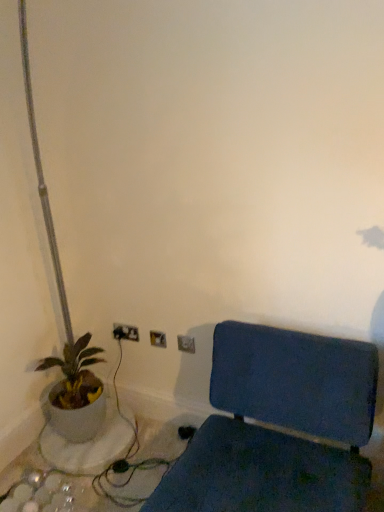
Question: In which direction should I rotate to look at metallic silver electric outlet at upper center, arranged as the first electric outlet when viewed from the right?

Choices:
 (A) left
 (B) right

Answer: (A)

Question: Does metallic silver electric outlet at center, the second electric outlet positioned from the back, have a smaller size compared to metallic silver electric outlet at upper center, acting as the 1th electric outlet starting from the front?

Choices:
 (A) no
 (B) yes

Answer: (B)

Question: Can you confirm if metallic silver electric outlet at center, which is the second electric outlet in front-to-back order, is shorter than metallic silver electric outlet at upper center, arranged as the first electric outlet when viewed from the right?

Choices:
 (A) yes
 (B) no

Answer: (A)

Question: Is metallic silver electric outlet at center, placed as the 2th electric outlet when sorted from left to right, to the right of metallic silver electric outlet at upper center, arranged as the first electric outlet when viewed from the right, from the viewer's perspective?

Choices:
 (A) yes
 (B) no

Answer: (B)

Question: Would you say metallic silver electric outlet at center, acting as the second electric outlet starting from the right, is a long distance from metallic silver electric outlet at upper center, arranged as the first electric outlet when viewed from the right?

Choices:
 (A) no
 (B) yes

Answer: (A)

Question: Could you tell me if metallic silver electric outlet at center, placed as the 2th electric outlet when sorted from left to right, is facing metallic silver electric outlet at upper center, which is the 3th electric outlet in left-to-right order?

Choices:
 (A) no
 (B) yes

Answer: (A)

Question: Is metallic silver electric outlet at center, acting as the second electric outlet starting from the right, completely or partially outside of metallic silver electric outlet at upper center, arranged as the first electric outlet when viewed from the right?

Choices:
 (A) yes
 (B) no

Answer: (A)

Question: Does metallic silver electric outlet at upper center, acting as the 1th electric outlet starting from the front, have a greater width compared to matte white pot at left?

Choices:
 (A) no
 (B) yes

Answer: (A)

Question: Could you tell me if metallic silver electric outlet at upper center, which is the 3th electric outlet in left-to-right order, is turned towards matte white pot at left?

Choices:
 (A) no
 (B) yes

Answer: (A)

Question: From the image's perspective, is metallic silver electric outlet at upper center, arranged as the first electric outlet when viewed from the right, on matte white pot at left?

Choices:
 (A) yes
 (B) no

Answer: (A)

Question: Is metallic silver electric outlet at upper center, the third electric outlet when ordered from back to front, oriented away from matte white pot at left?

Choices:
 (A) no
 (B) yes

Answer: (A)

Question: From a real-world perspective, is metallic silver electric outlet at upper center, acting as the 1th electric outlet starting from the front, physically below matte white pot at left?

Choices:
 (A) yes
 (B) no

Answer: (B)

Question: Can you confirm if metallic silver electric outlet at upper center, the third electric outlet when ordered from back to front, is positioned to the right of matte white pot at left?

Choices:
 (A) yes
 (B) no

Answer: (A)

Question: Can you confirm if metallic silver electric outlet at upper center, the third electric outlet when ordered from back to front, is shorter than metallic silver electric outlet at lower center, placed as the 1th electric outlet when sorted from back to front?

Choices:
 (A) no
 (B) yes

Answer: (A)